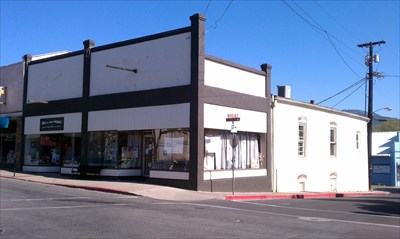
This screenshot has width=400, height=239. What are the coordinates of `windows` in the screenshot? It's located at (212, 150), (164, 150), (90, 149), (68, 148), (36, 148).